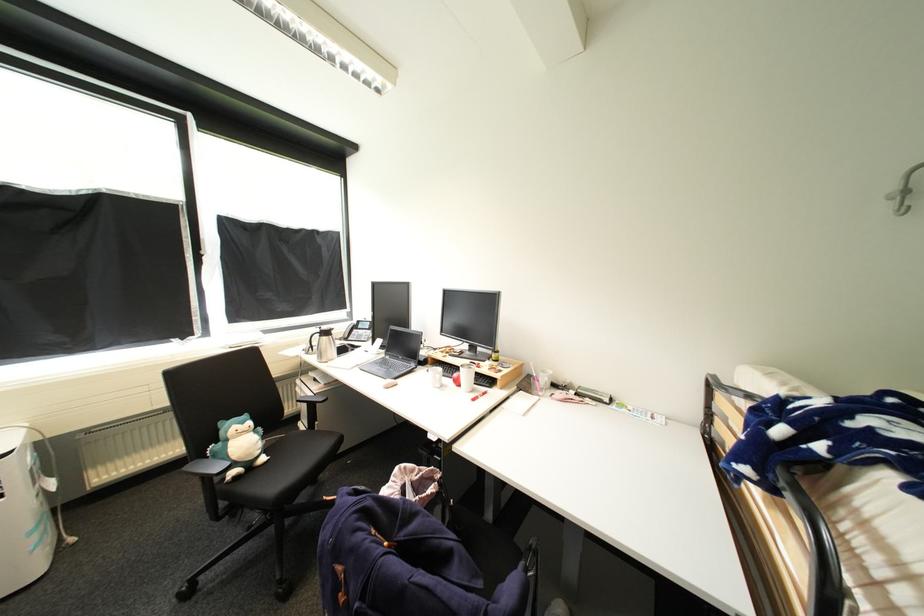
Where is `telephone handset`? The image size is (924, 616). telephone handset is located at coordinates (357, 331).